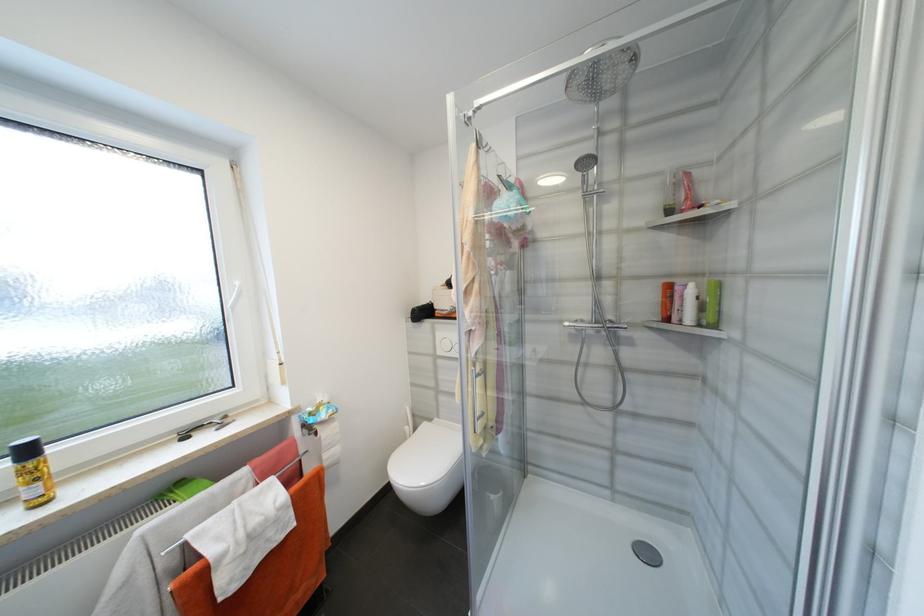
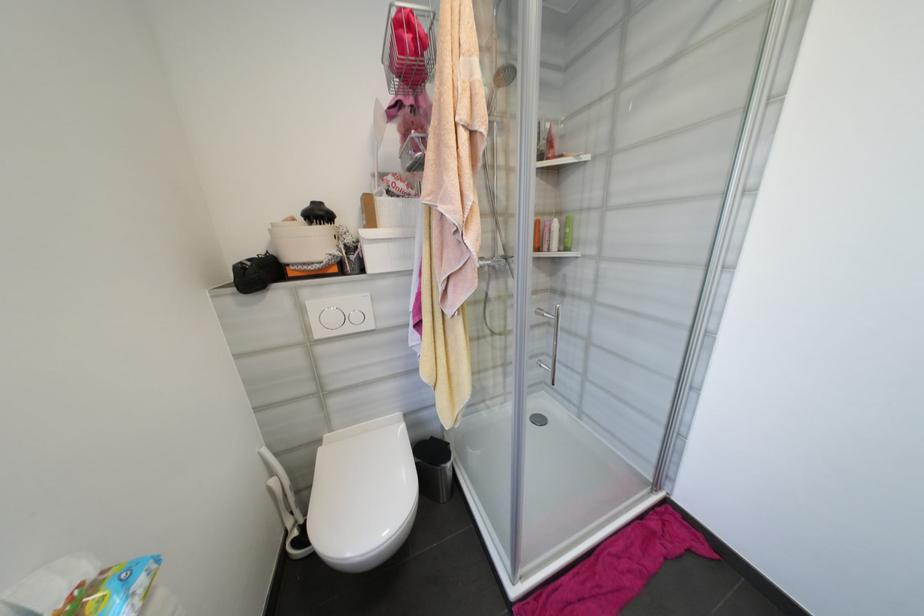
Locate, in the second image, the point that corresponds to (679,320) in the first image.

(551, 249)